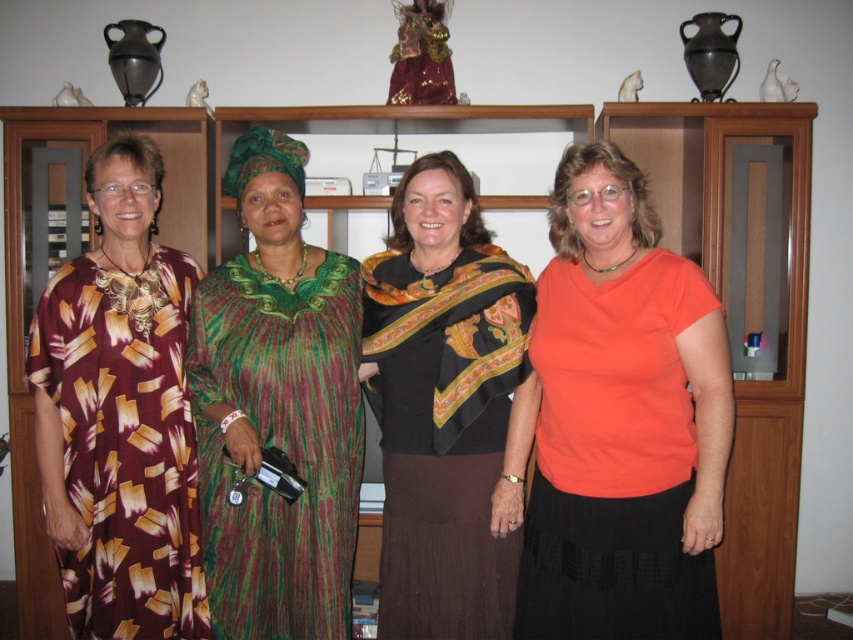
You are a photographer standing at a specific spot. You want to take a closeup shot of the orange matte shirt at center. The minimum focusing distance of your camera is 5 feet. Can you take the photo without moving your position?

The distance between the orange matte shirt at center and the camera is 5.90 feet, which is greater than the minimum focusing distance of 5 feet. Therefore, you can take the closeup shot without moving your position.